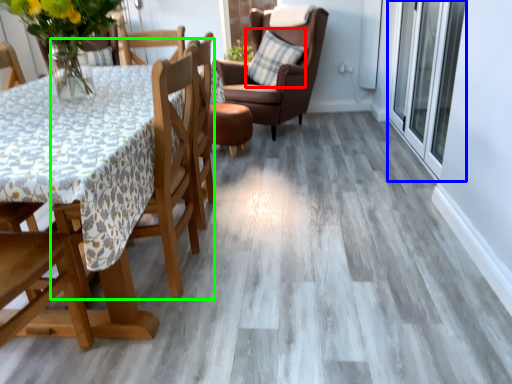
Question: Which is nearer to the pillow (highlighted by a red box)? screen door (highlighted by a blue box) or chair (highlighted by a green box).

Choices:
 (A) screen door
 (B) chair

Answer: (A)